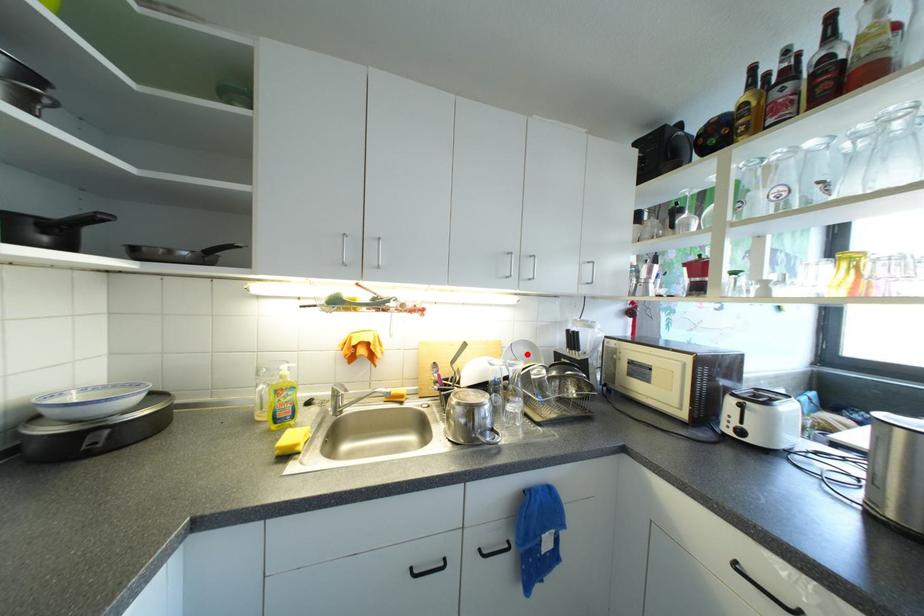
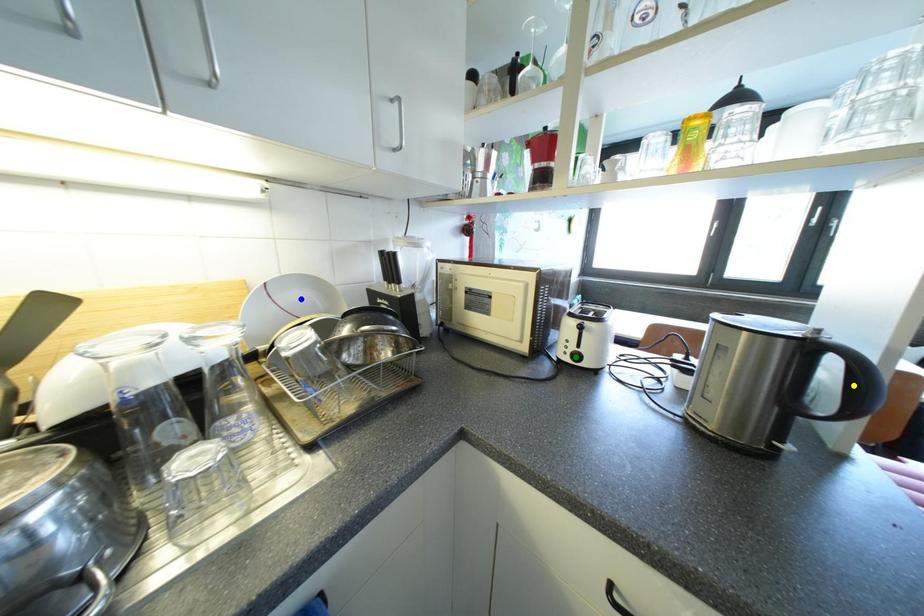
Question: I am providing you with two images of the same scene from different viewpoints. A red point is marked on the first image. You are given multiple points on the second image. Which spot in image 2 lines up with the point in image 1?

Choices:
 (A) yellow point
 (B) blue point
 (C) green point

Answer: (B)